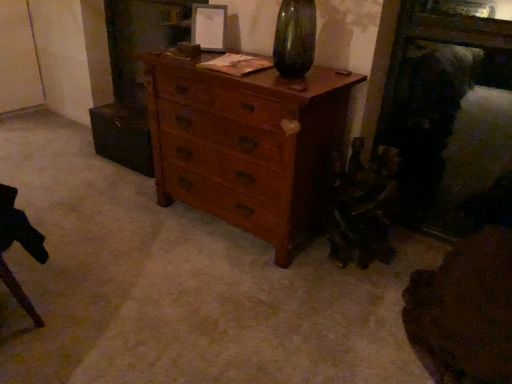
What is the approximate height of wooden chest of drawers at center?

wooden chest of drawers at center is 33.77 inches tall.

Locate an element on the screen. The image size is (512, 384). wooden chest of drawers at center is located at coordinates (246, 144).

The height and width of the screenshot is (384, 512). What do you see at coordinates (246, 144) in the screenshot?
I see `wooden chest of drawers at center` at bounding box center [246, 144].

The height and width of the screenshot is (384, 512). Find the location of `wooden chest of drawers at center`. wooden chest of drawers at center is located at coordinates (246, 144).